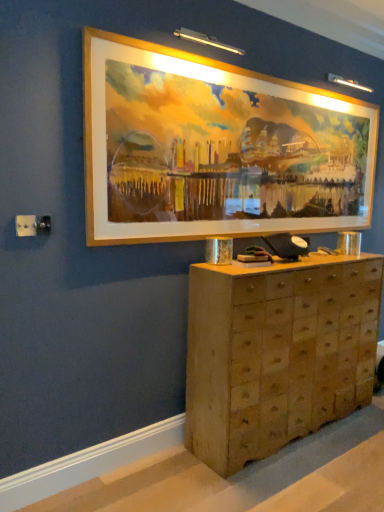
Locate an element on the screen. This screenshot has width=384, height=512. vacant space in front of wooden chest of drawers at center is located at coordinates (304, 476).